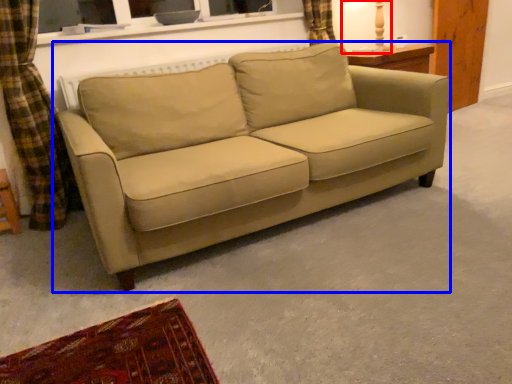
Question: Which object appears farthest to the camera in this image, table lamp (highlighted by a red box) or studio couch (highlighted by a blue box)?

Choices:
 (A) table lamp
 (B) studio couch

Answer: (A)